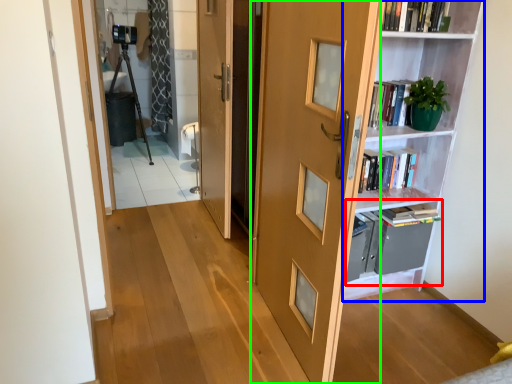
Question: Based on their relative distances, which object is farther from cabinet (highlighted by a red box)? Choose from shelf (highlighted by a blue box) and door (highlighted by a green box).

Choices:
 (A) shelf
 (B) door

Answer: (B)